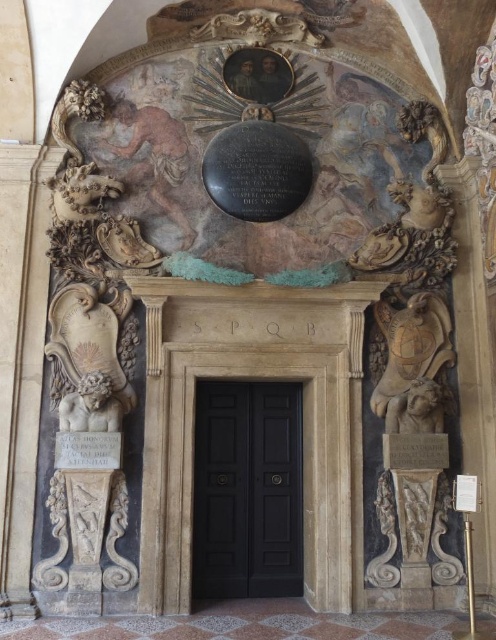
Question: Can you confirm if white marble plaque at lower left is smaller than white paper at lower right?

Choices:
 (A) yes
 (B) no

Answer: (B)

Question: Which point is closer to the camera?

Choices:
 (A) matte stone plaque at right
 (B) white marble lion at lower left
 (C) white paper at lower right
 (D) black wooden door at center

Answer: (C)

Question: Does black wooden door at center come behind white marble plaque at lower left?

Choices:
 (A) no
 (B) yes

Answer: (B)

Question: Which object appears farthest from the camera in this image?

Choices:
 (A) matte stone plaque at right
 (B) black wooden door at center
 (C) white marble plaque at lower left
 (D) white marble lion at lower left

Answer: (B)

Question: Which point is farther to the camera?

Choices:
 (A) matte stone plaque at right
 (B) white marble lion at lower left

Answer: (A)

Question: Can you confirm if black wooden door at center is wider than matte stone plaque at right?

Choices:
 (A) no
 (B) yes

Answer: (B)